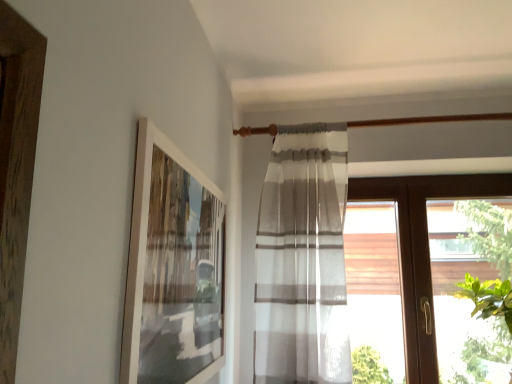
Question: Should I look upward or downward to see brown wood window at right?

Choices:
 (A) up
 (B) down

Answer: (B)

Question: From the image's perspective, does green leafy plant at right appear lower than brown wood window at right?

Choices:
 (A) yes
 (B) no

Answer: (A)

Question: Is green leafy plant at right smaller than brown wood window at right?

Choices:
 (A) yes
 (B) no

Answer: (B)

Question: Does green leafy plant at right contain brown wood window at right?

Choices:
 (A) no
 (B) yes

Answer: (A)

Question: Is green leafy plant at right further to the viewer compared to brown wood window at right?

Choices:
 (A) no
 (B) yes

Answer: (A)

Question: Is green leafy plant at right thinner than brown wood window at right?

Choices:
 (A) no
 (B) yes

Answer: (A)

Question: Are green leafy plant at right and brown wood window at right making contact?

Choices:
 (A) no
 (B) yes

Answer: (A)

Question: Is green leafy plant at right taller than white matte picture frame at upper left?

Choices:
 (A) yes
 (B) no

Answer: (A)

Question: Is the depth of green leafy plant at right less than that of white matte picture frame at upper left?

Choices:
 (A) no
 (B) yes

Answer: (A)

Question: Considering the relative sizes of green leafy plant at right and white matte picture frame at upper left in the image provided, is green leafy plant at right shorter than white matte picture frame at upper left?

Choices:
 (A) yes
 (B) no

Answer: (B)

Question: From a real-world perspective, is green leafy plant at right positioned over white matte picture frame at upper left based on gravity?

Choices:
 (A) no
 (B) yes

Answer: (A)

Question: Can you see green leafy plant at right touching white matte picture frame at upper left?

Choices:
 (A) no
 (B) yes

Answer: (A)

Question: Considering the relative positions of green leafy plant at right and white matte picture frame at upper left in the image provided, is green leafy plant at right to the left of white matte picture frame at upper left from the viewer's perspective?

Choices:
 (A) no
 (B) yes

Answer: (A)

Question: From a real-world perspective, is brown wood window at right under white matte picture frame at upper left?

Choices:
 (A) yes
 (B) no

Answer: (A)